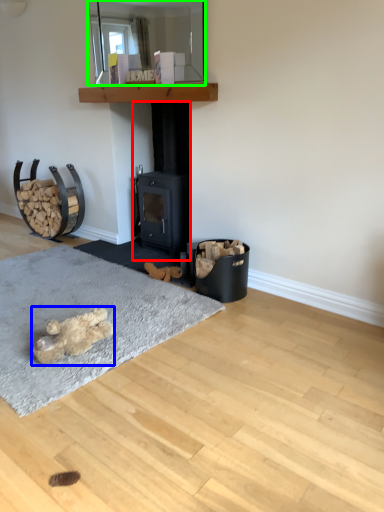
Question: Estimate the real-world distances between objects in this image. Which object is closer to fireplace (highlighted by a red box), animal (highlighted by a blue box) or mirror (highlighted by a green box)?

Choices:
 (A) animal
 (B) mirror

Answer: (B)